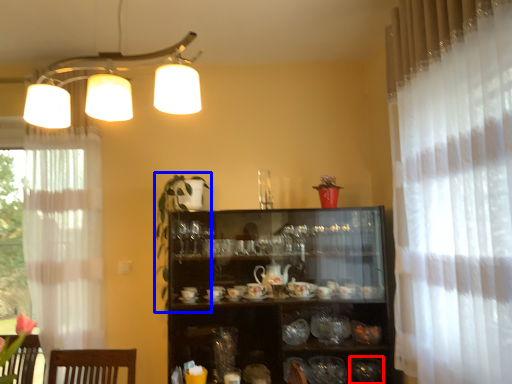
Question: Among these objects, which one is farthest to the camera, tableware (highlighted by a red box) or plant (highlighted by a blue box)?

Choices:
 (A) tableware
 (B) plant

Answer: (A)